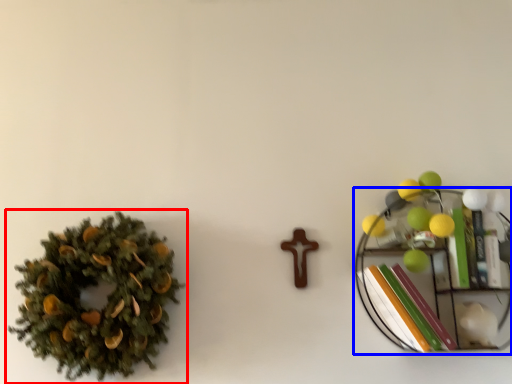
Question: Which point is further to the camera, houseplant (highlighted by a red box) or shelf (highlighted by a blue box)?

Choices:
 (A) houseplant
 (B) shelf

Answer: (B)